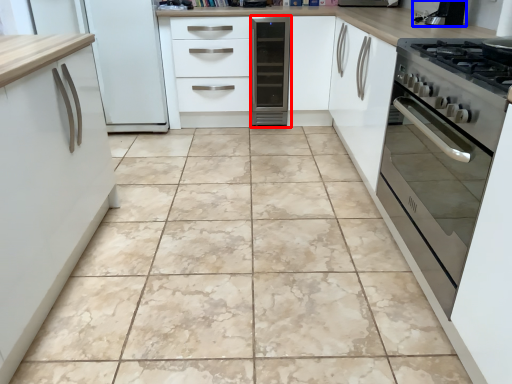
Question: Which of the following is the closest to the observer, home appliance (highlighted by a red box) or appliance (highlighted by a blue box)?

Choices:
 (A) home appliance
 (B) appliance

Answer: (B)